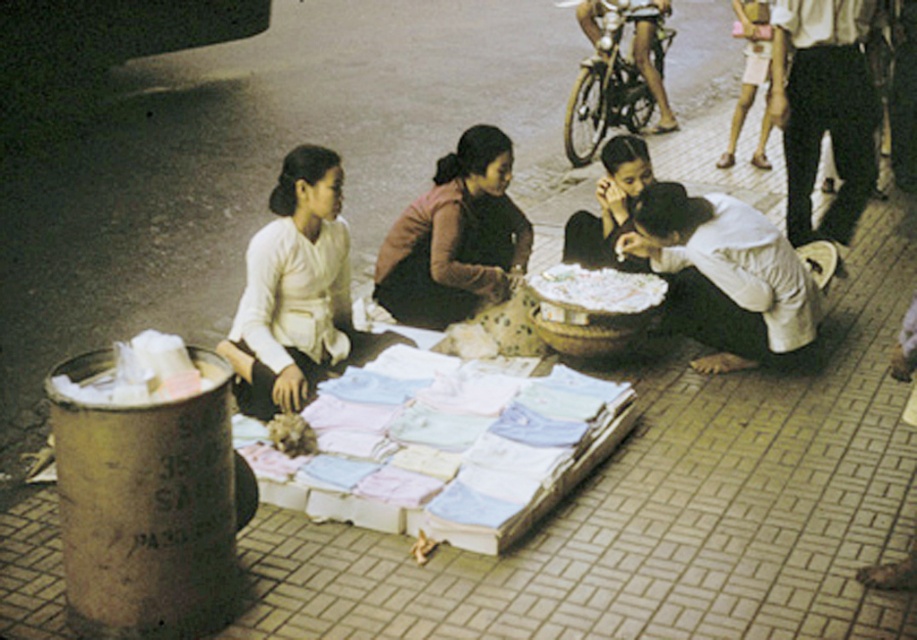
You are a customer looking to buy a matte white blouse at left and a white matte fabric at lower center. Which item is located more to the left?

The matte white blouse at left is more to the left than the white matte fabric at lower center.

You are standing at the viewpoint of the image and want to place a small sign at the closest point between the two points, point (783, 269) and point (470, 300). Which point should the sign be placed closer to?

The sign should be placed closer to point (783, 269) because it is closer to the viewer than point (470, 300).